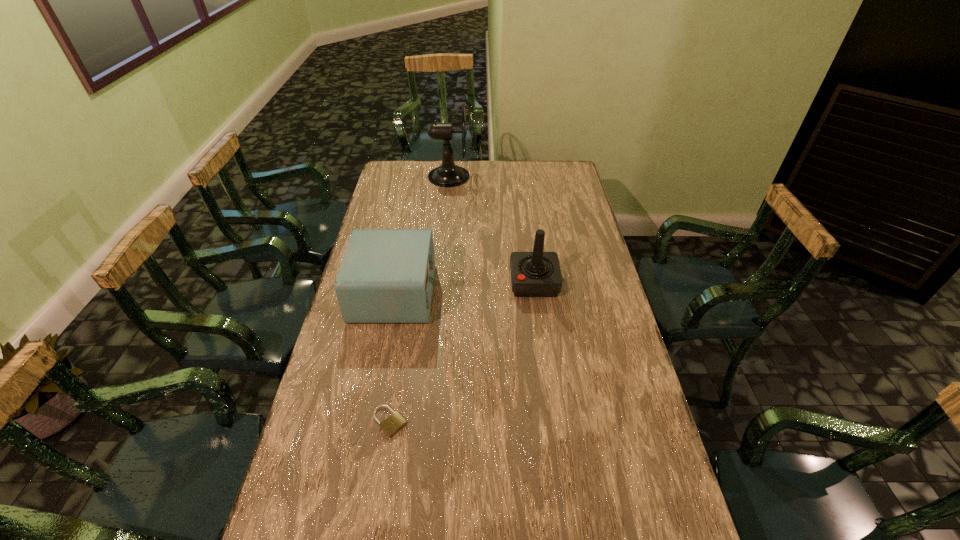
Find the location of a particular element. The height and width of the screenshot is (540, 960). blank space located on the front-facing side of the third shortest object is located at coordinates (449, 282).

Locate an element on the screen. vacant space located on the front panel of the third tallest object is located at coordinates (531, 293).

Locate an element on the screen. vacant space located on the back of the padlock is located at coordinates (395, 390).

At what (x,y) coordinates should I click in order to perform the action: click on object present at the far edge. Please return your answer as a coordinate pair (x, y). The image size is (960, 540). Looking at the image, I should click on (448, 174).

Where is `object that is at the left edge`? object that is at the left edge is located at coordinates [x=386, y=275].

Find the location of a particular element. This screenshot has height=540, width=960. free space at the far edge of the desktop is located at coordinates (519, 180).

Locate an element on the screen. vacant region at the left edge of the desktop is located at coordinates (358, 484).

Identify the location of free space at the right edge. (650, 536).

In the image, there is a desktop. In order to click on vacant space at the far left corner in this screenshot , I will do `click(394, 180)`.

In the image, there is a desktop. Identify the location of free space at the far right corner. The width and height of the screenshot is (960, 540). (575, 174).